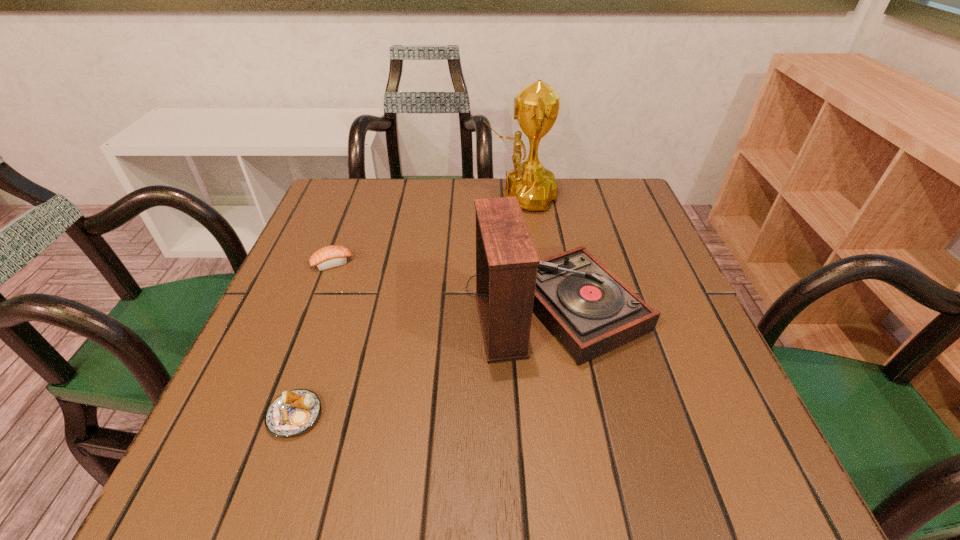
Identify the location of the farthest object. (536, 106).

This screenshot has height=540, width=960. Find the location of `the tallest object`. the tallest object is located at coordinates [x=536, y=106].

Find the location of a particular element. Image resolution: width=960 pixels, height=540 pixels. the second tallest object is located at coordinates (590, 311).

The height and width of the screenshot is (540, 960). I want to click on sushi, so click(333, 256).

I want to click on pastry, so click(x=292, y=413).

Locate an element on the screen. The width and height of the screenshot is (960, 540). the nearest object is located at coordinates (292, 413).

Where is `vacant region located 0.110m on the front side of the tallest object`? The width and height of the screenshot is (960, 540). vacant region located 0.110m on the front side of the tallest object is located at coordinates (442, 197).

I want to click on vacant area situated 0.050m on the front side of the tallest object, so point(464,197).

You are a GUI agent. You are given a task and a screenshot of the screen. Output one action in this format:
    pyautogui.click(x=<x>, y=<y>)
    Task: Click on the free spot located on the front side of the tallest object
    This screenshot has height=540, width=960.
    Given the screenshot: What is the action you would take?
    pyautogui.click(x=372, y=197)

Find the location of a particular element. The width and height of the screenshot is (960, 540). vacant space situated 0.220m on the back of the second tallest object is located at coordinates (538, 207).